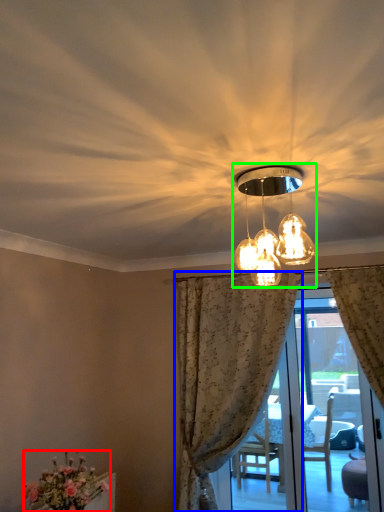
Question: Based on their relative distances, which object is nearer to flower (highlighted by a red box)? Choose from curtain (highlighted by a blue box) and lamp (highlighted by a green box).

Choices:
 (A) curtain
 (B) lamp

Answer: (A)